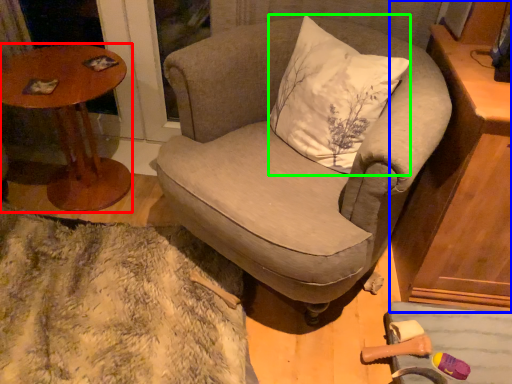
Question: Estimate the real-world distances between objects in this image. Which object is farther from table (highlighted by a red box), cabinetry (highlighted by a blue box) or pillow (highlighted by a green box)?

Choices:
 (A) cabinetry
 (B) pillow

Answer: (A)